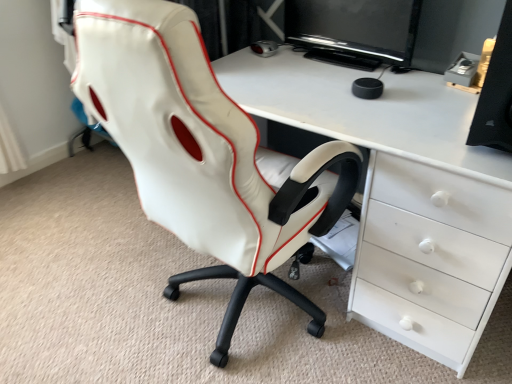
Identify the location of black glossy monitor at upper center. (356, 27).

Image resolution: width=512 pixels, height=384 pixels. What are the coordinates of `white glossy desk at center` in the screenshot? It's located at (402, 194).

Identify the location of black matte speaker at right. The width and height of the screenshot is (512, 384). (496, 93).

From the image's perspective, is white leather chair at center over black glossy monitor at upper center?

No, from the image's perspective, white leather chair at center is not over black glossy monitor at upper center.

In the scene shown: Which of these two, white leather chair at center or black glossy monitor at upper center, is smaller?

black glossy monitor at upper center is smaller.

Locate an element on the screen. This screenshot has width=512, height=384. computer monitor that is above the white leather chair at center (from the image's perspective) is located at coordinates [356, 27].

Is white leather chair at center inside or outside of black glossy monitor at upper center?

white leather chair at center is not inside black glossy monitor at upper center, it's outside.

Considering the sizes of objects white leather chair at center and black matte speaker at right in the image provided, who is wider, white leather chair at center or black matte speaker at right?

Wider between the two is white leather chair at center.

Is white leather chair at center facing away from black matte speaker at right?

No.

From the image's perspective, is white leather chair at center above black matte speaker at right?

No, from the image's perspective, white leather chair at center is not above black matte speaker at right.

From the picture: Which is more to the right, white leather chair at center or black matte speaker at right?

black matte speaker at right.

Is white leather chair at center to the left or to the right of white glossy desk at center in the image?

white leather chair at center is positioned on white glossy desk at center's left side.

Based on the photo, how distant is white leather chair at center from white glossy desk at center?

The distance of white leather chair at center from white glossy desk at center is 12.48 inches.

Considering the positions of objects white leather chair at center and white glossy desk at center in the image provided, who is behind, white leather chair at center or white glossy desk at center?

white glossy desk at center is further from the camera.

Considering the relative sizes of white leather chair at center and white glossy desk at center in the image provided, is white leather chair at center thinner than white glossy desk at center?

No, white leather chair at center is not thinner than white glossy desk at center.

Where is `speaker below the black glossy monitor at upper center (from the image's perspective)`? The image size is (512, 384). speaker below the black glossy monitor at upper center (from the image's perspective) is located at coordinates (496, 93).

Is black matte speaker at right shorter than black glossy monitor at upper center?

Incorrect, the height of black matte speaker at right does not fall short of that of black glossy monitor at upper center.

From the image's perspective, who appears lower, black matte speaker at right or black glossy monitor at upper center?

black matte speaker at right.

Is black matte speaker at right beside black glossy monitor at upper center?

No, black matte speaker at right is not touching black glossy monitor at upper center.

Could you tell me if black matte speaker at right is facing white glossy desk at center?

No, black matte speaker at right does not turn towards white glossy desk at center.

Looking at their sizes, would you say black matte speaker at right is wider or thinner than white glossy desk at center?

black matte speaker at right is thinner than white glossy desk at center.

Is black matte speaker at right directly adjacent to white glossy desk at center?

black matte speaker at right and white glossy desk at center are clearly separated.

From the image's perspective, is black glossy monitor at upper center over white glossy desk at center?

Indeed, from the image's perspective, black glossy monitor at upper center is shown above white glossy desk at center.

Considering the positions of point (370, 46) and point (484, 197), is point (370, 46) closer or farther from the camera than point (484, 197)?

Clearly, point (370, 46) is more distant from the camera than point (484, 197).

Which object is wider, black glossy monitor at upper center or white glossy desk at center?

Wider between the two is white glossy desk at center.

Between point (407, 10) and point (177, 86), which one is positioned in front?

The point (177, 86) is closer to the camera.

From the image's perspective, is black glossy monitor at upper center positioned above or below white leather chair at center?

black glossy monitor at upper center is situated higher than white leather chair at center in the image.

In the scene shown: Who is bigger, black glossy monitor at upper center or white leather chair at center?

With larger size is white leather chair at center.

The width and height of the screenshot is (512, 384). Identify the location of computer monitor above the white leather chair at center (from the image's perspective). (356, 27).

At what (x,y) coordinates should I click in order to perform the action: click on chair on the left of the black glossy monitor at upper center. Please return your answer as a coordinate pair (x, y). Looking at the image, I should click on (204, 153).

Locate an element on the screen. This screenshot has height=384, width=512. chair located underneath the black matte speaker at right (from a real-world perspective) is located at coordinates (204, 153).

Considering their positions, is black glossy monitor at upper center positioned closer to white leather chair at center than black matte speaker at right?

Among the two, black matte speaker at right is located nearer to white leather chair at center.

From the image, which object appears to be nearer to black glossy monitor at upper center, black matte speaker at right or white leather chair at center?

Based on the image, black matte speaker at right appears to be nearer to black glossy monitor at upper center.

Looking at the image, which one is located closer to white glossy desk at center, black matte speaker at right or white leather chair at center?

The object closer to white glossy desk at center is white leather chair at center.

Based on their spatial positions, is white glossy desk at center or black matte speaker at right closer to white leather chair at center?

The object closer to white leather chair at center is white glossy desk at center.

When comparing their distances from white glossy desk at center, does black glossy monitor at upper center or white leather chair at center seem further?

Among the two, black glossy monitor at upper center is located further to white glossy desk at center.

Estimate the real-world distances between objects in this image. Which object is closer to white glossy desk at center, white leather chair at center or black matte speaker at right?

The object closer to white glossy desk at center is white leather chair at center.

Estimate the real-world distances between objects in this image. Which object is further from white leather chair at center, black glossy monitor at upper center or white glossy desk at center?

Based on the image, black glossy monitor at upper center appears to be further to white leather chair at center.

Based on their spatial positions, is white glossy desk at center or black glossy monitor at upper center closer to black matte speaker at right?

white glossy desk at center is closer to black matte speaker at right.

Find the location of a particular element. The height and width of the screenshot is (384, 512). desk located between white leather chair at center and black glossy monitor at upper center in the depth direction is located at coordinates (402, 194).

I want to click on speaker between white leather chair at center and black glossy monitor at upper center from front to back, so click(x=496, y=93).

The width and height of the screenshot is (512, 384). Identify the location of desk between black matte speaker at right and black glossy monitor at upper center along the z-axis. (402, 194).

Find the location of a particular element. Image resolution: width=512 pixels, height=384 pixels. desk between white leather chair at center and black matte speaker at right is located at coordinates (402, 194).